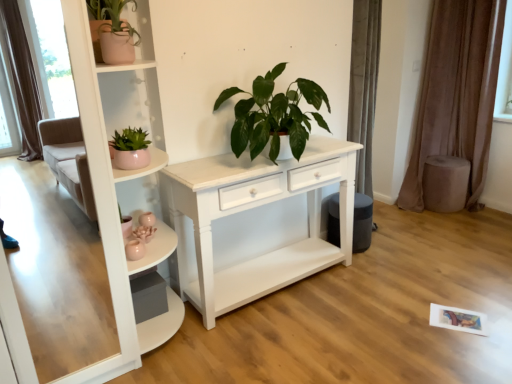
Locate an element on the screen. The width and height of the screenshot is (512, 384). blank area beneath green glossy plant at center, marked as the first houseplant in a right-to-left arrangement (from a real-world perspective) is located at coordinates (296, 293).